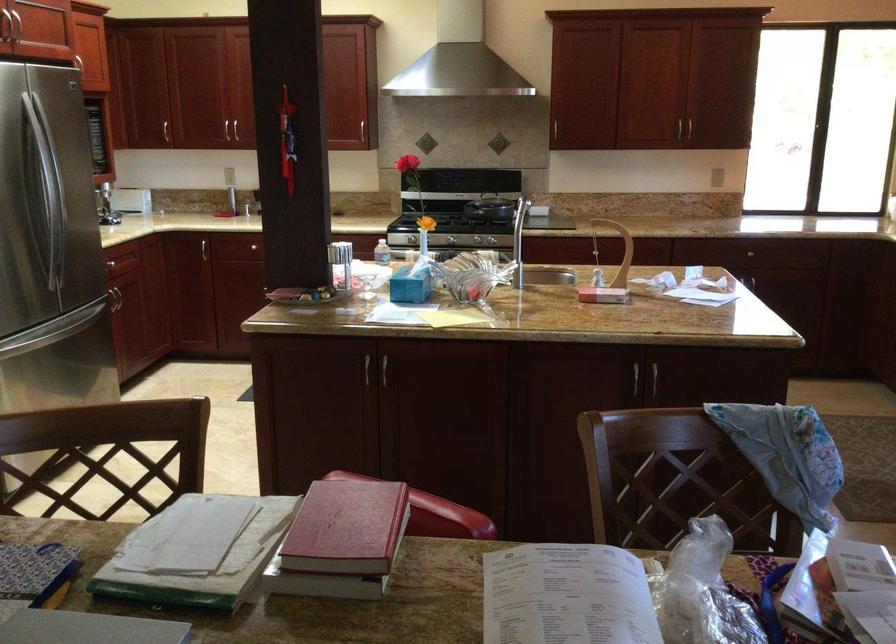
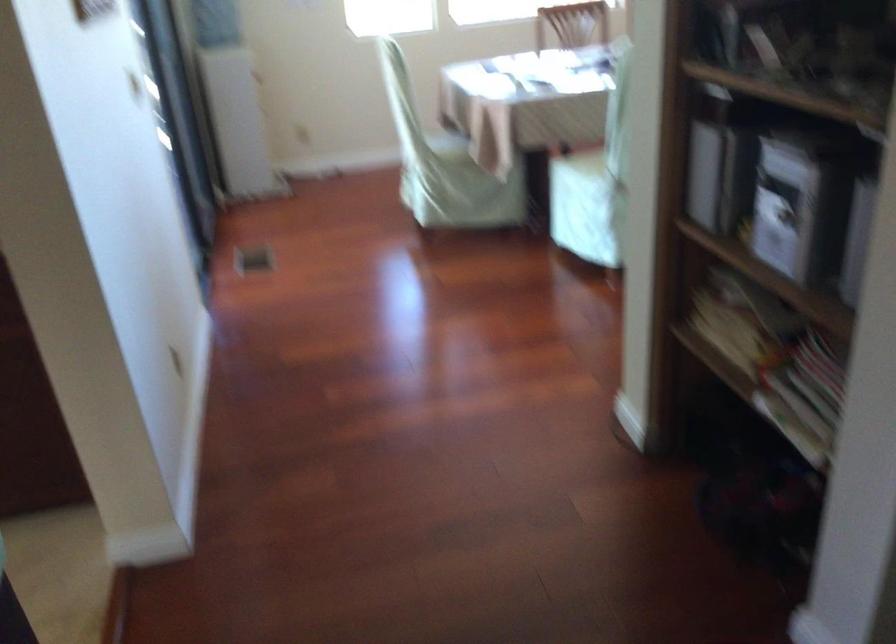
How did the camera likely rotate?

The rotation direction of the camera is right-down.